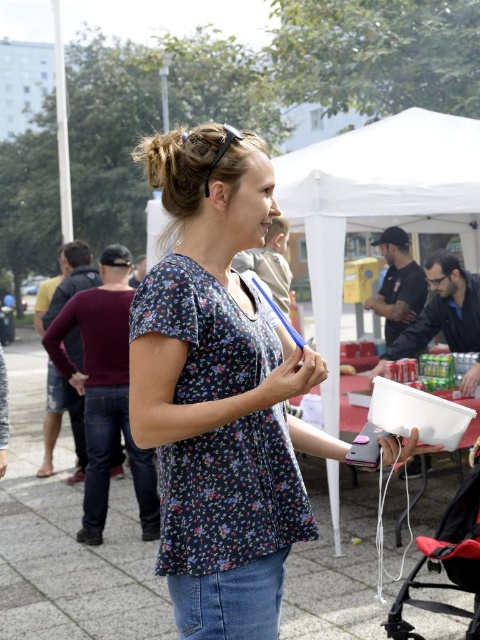
You are a photographer trying to capture a photo of the woman in the floral fabric blouse at center and the white fabric tent at upper center. Since you want both subjects to be clearly visible, will the blouse be wider than the tent in the photo?

The floral fabric blouse at center has a lesser width compared to the white fabric tent at upper center, so the blouse will not be wider than the tent in the photo.

You are a tailor who needs to determine which fabric item requires more material to make between the floral fabric blouse at center and the red fabric baby carriage at lower right. Based on the scene, which one would need more fabric?

The floral fabric blouse at center is bigger than the red fabric baby carriage at lower right, so it would require more fabric to make.

You are a visitor at this event and want to know which object is shorter between the floral fabric blouse at center and the white fabric tent at upper center. Can you tell me?

The floral fabric blouse at center is not as tall as the white fabric tent at upper center, so the floral fabric blouse at center is shorter.